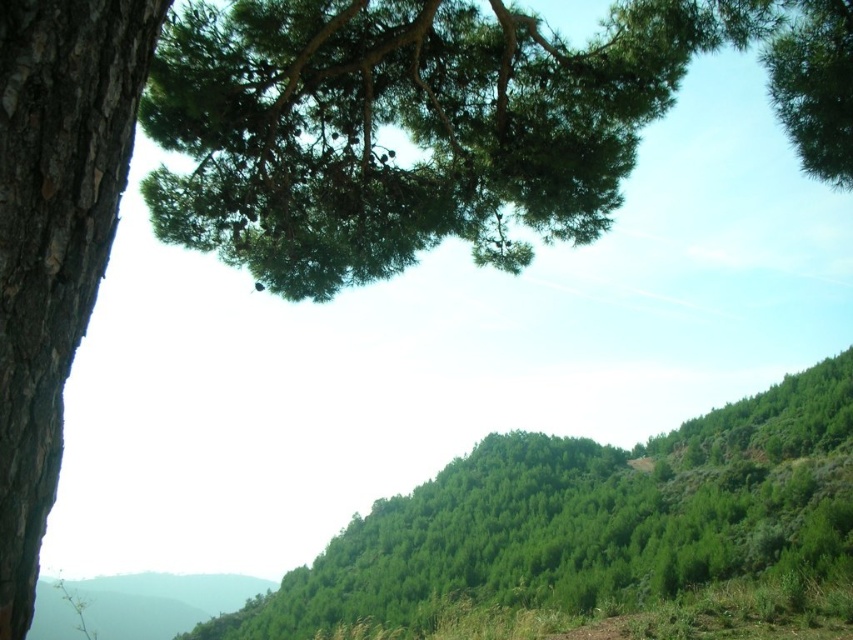
Does green needle-like leaves at upper center have a lesser height compared to smooth bark tree at left?

Indeed, green needle-like leaves at upper center has a lesser height compared to smooth bark tree at left.

Is green needle-like leaves at upper center smaller than smooth bark tree at left?

Actually, green needle-like leaves at upper center might be larger than smooth bark tree at left.

Locate an element on the screen. This screenshot has height=640, width=853. green needle-like leaves at upper center is located at coordinates 403,128.

Can you confirm if green leafy tree at center is wider than smooth bark tree at left?

Indeed, green leafy tree at center has a greater width compared to smooth bark tree at left.

In the scene shown: Which of these two, green leafy tree at center or smooth bark tree at left, stands shorter?

Standing shorter between the two is smooth bark tree at left.

Identify the location of green leafy tree at center. (589, 520).

Is point (318, 180) positioned behind point (494, 433)?

No, it is not.

Between green needle-like leaves at upper center and green leafy tree at center, which one appears on the left side from the viewer's perspective?

green needle-like leaves at upper center is more to the left.

Where is `green needle-like leaves at upper center`? The width and height of the screenshot is (853, 640). green needle-like leaves at upper center is located at coordinates (403, 128).